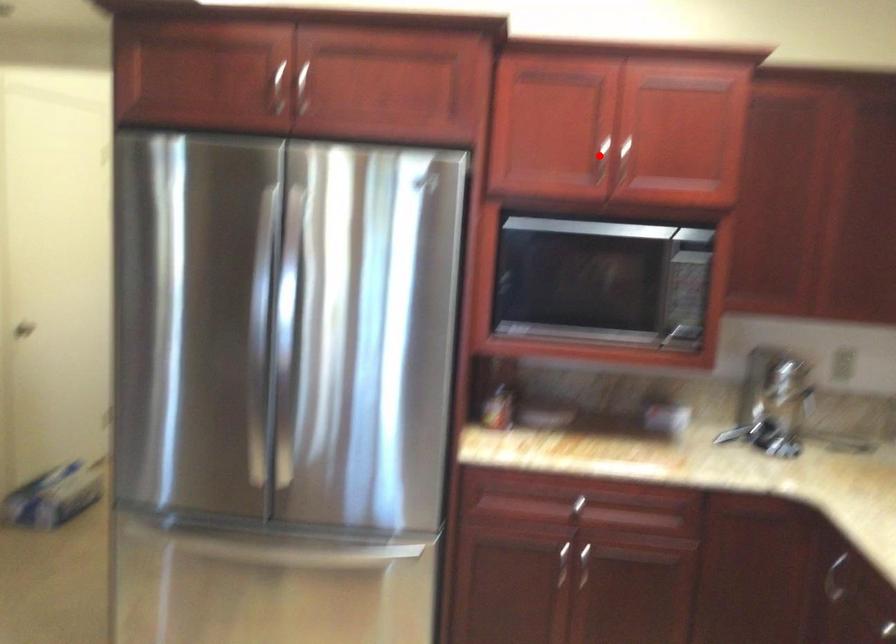
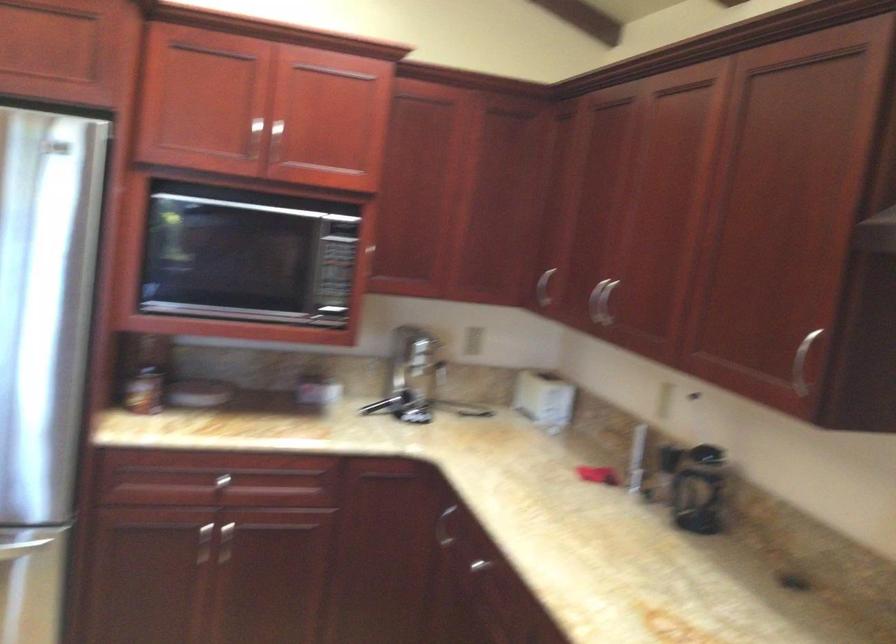
Find the pixel in the second image that matches the highlighted location in the first image.

(254, 138)